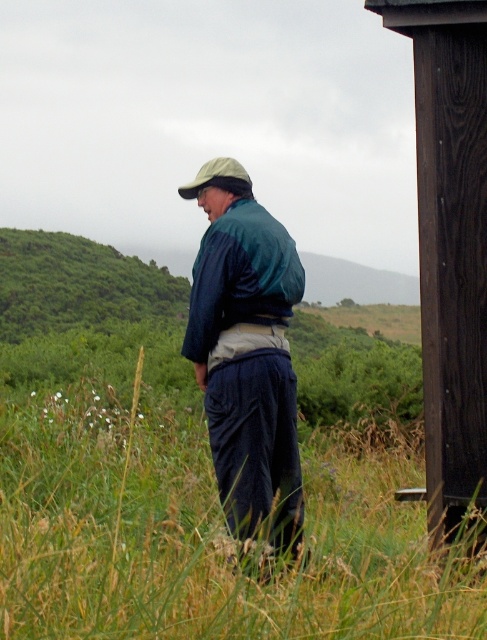
You are a photographer trying to capture the green fabric jacket at center in the image. If the camera is focused at point 0.5, 0.5, will the jacket be in focus?

The green fabric jacket at center is located at point (245, 352), which is very close to the focus point of (243, 320). Therefore, the jacket will be in focus.

You are a photographer trying to capture a clear shot of the person in the scene. Since both the green fabric jacket at center and the green fabric hat at upper center are present, which one is closer to the camera?

The green fabric jacket at center is closer to the camera because it is in front of the green fabric hat at upper center.